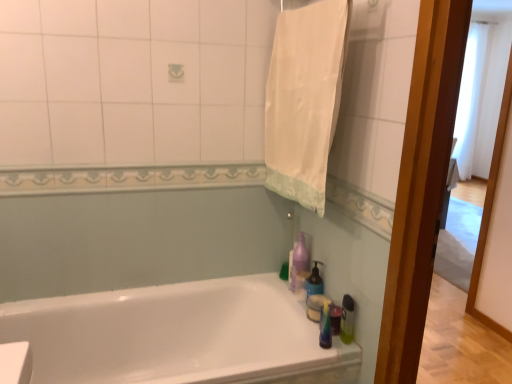
Question: In the image, is white glossy bathtub at lower center on the left side or the right side of translucent plastic soap dispenser at right, arranged as the second cleaning product when viewed from the front?

Choices:
 (A) left
 (B) right

Answer: (A)

Question: Considering the positions of point (282, 354) and point (317, 284), is point (282, 354) closer or farther from the camera than point (317, 284)?

Choices:
 (A) farther
 (B) closer

Answer: (B)

Question: Estimate the real-world distances between objects in this image. Which object is closer to the white cotton towel at upper right?

Choices:
 (A) green translucent bottle at right, which is the first cleaning product from front to back
 (B) translucent plastic soap dispenser at right, the 2th cleaning product when ordered from back to front
 (C) purple glossy bottle at upper right, the first cleaning product in the back-to-front sequence
 (D) white glossy bathtub at lower center

Answer: (C)

Question: Which object is positioned closest to the white glossy bathtub at lower center?

Choices:
 (A) white cotton towel at upper right
 (B) translucent plastic soap dispenser at right, the 2th cleaning product when ordered from back to front
 (C) purple glossy bottle at upper right, which is the third cleaning product in front-to-back order
 (D) green translucent bottle at right, arranged as the 3th cleaning product when viewed from the back

Answer: (C)